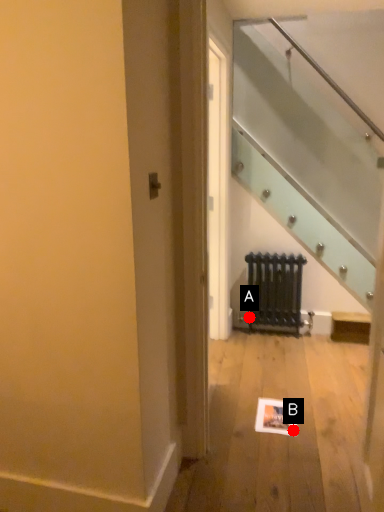
Question: Two points are circled on the image, labeled by A and B beside each circle. Which point is further to the camera?

Choices:
 (A) A is further
 (B) B is further

Answer: (A)